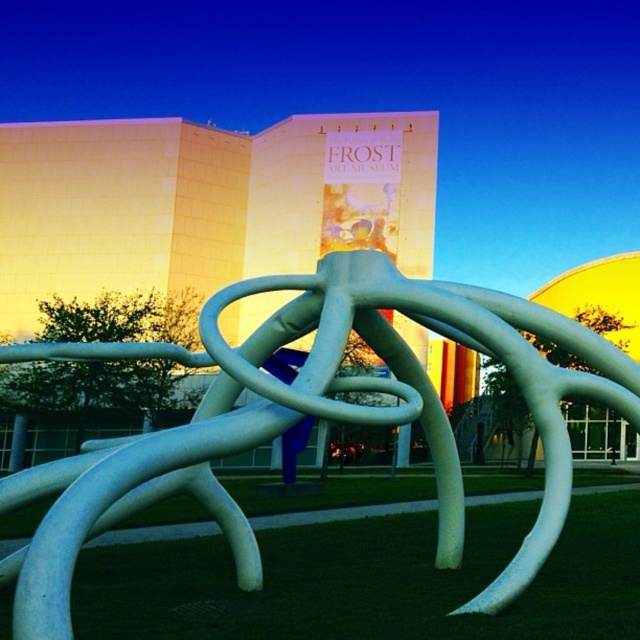
Question: Which of the following is the farthest from the observer?

Choices:
 (A) (508, 522)
 (B) (33, 609)

Answer: (A)

Question: Does white glossy sculpture at center come in front of green grass at lower center?

Choices:
 (A) no
 (B) yes

Answer: (B)

Question: Does white glossy sculpture at center have a lesser width compared to green grass at lower center?

Choices:
 (A) no
 (B) yes

Answer: (B)

Question: Is white glossy sculpture at center behind green grass at lower center?

Choices:
 (A) yes
 (B) no

Answer: (B)

Question: Among these points, which one is nearest to the camera?

Choices:
 (A) (326, 557)
 (B) (4, 353)

Answer: (B)

Question: Which point is closer to the camera?

Choices:
 (A) (198, 634)
 (B) (620, 380)

Answer: (A)